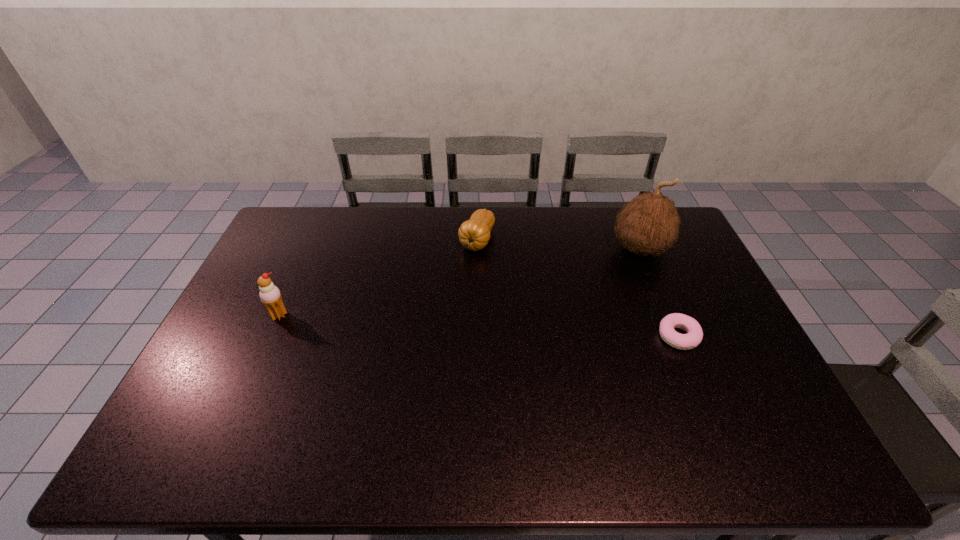
Locate an element on the screen. Image resolution: width=960 pixels, height=540 pixels. free space located 0.320m on the surface of the tallest object is located at coordinates (548, 296).

Find the location of a particular element. Image resolution: width=960 pixels, height=540 pixels. blank space located 0.120m on the stem side of the second shortest object is located at coordinates (460, 282).

I want to click on vacant space located 0.070m on the stem side of the second shortest object, so click(465, 272).

Where is `vacant point located 0.270m on the stem side of the second shortest object`? This screenshot has width=960, height=540. vacant point located 0.270m on the stem side of the second shortest object is located at coordinates (444, 315).

This screenshot has height=540, width=960. What are the coordinates of `coconut that is at the far edge` in the screenshot? It's located at (649, 224).

Image resolution: width=960 pixels, height=540 pixels. In order to click on gourd located at the far edge in this screenshot , I will do `click(474, 234)`.

At what (x,y) coordinates should I click in order to perform the action: click on object at the left edge. Please return your answer as a coordinate pair (x, y). This screenshot has height=540, width=960. Looking at the image, I should click on (269, 294).

Identify the location of pastry that is positioned at the right edge. (692, 339).

This screenshot has height=540, width=960. I want to click on coconut present at the right edge, so click(649, 224).

I want to click on object situated at the far right corner, so click(x=649, y=224).